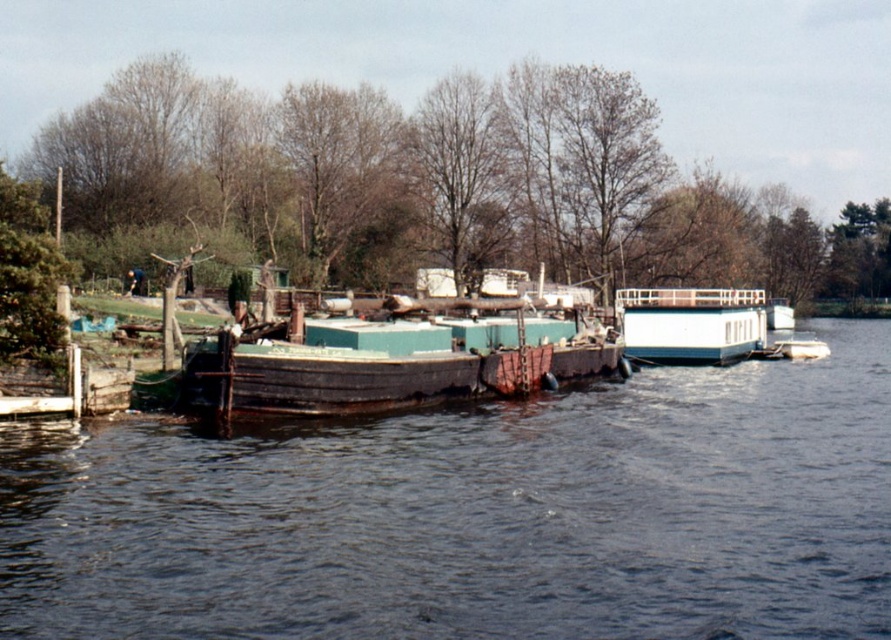
Question: Is dark brown water at center positioned before white glossy houseboat at center?

Choices:
 (A) no
 (B) yes

Answer: (B)

Question: Which object is closer to the camera taking this photo?

Choices:
 (A) white glossy houseboat at center
 (B) dark brown water at center

Answer: (B)

Question: Which of the following is the farthest from the observer?

Choices:
 (A) white glossy houseboat at center
 (B) dark brown water at center

Answer: (A)

Question: Does dark brown water at center have a smaller size compared to white glossy houseboat at center?

Choices:
 (A) no
 (B) yes

Answer: (B)

Question: Does dark brown water at center lie in front of white glossy houseboat at center?

Choices:
 (A) no
 (B) yes

Answer: (B)